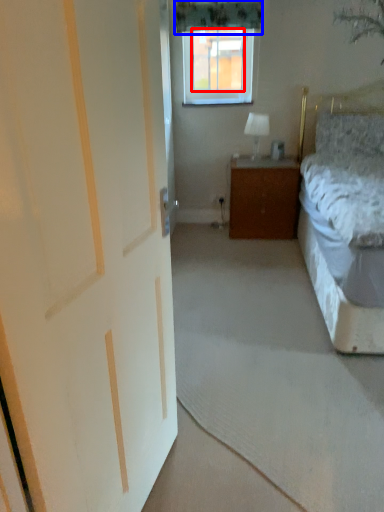
Question: Which of the following is the farthest to the observer, window screen (highlighted by a red box) or curtain (highlighted by a blue box)?

Choices:
 (A) window screen
 (B) curtain

Answer: (A)